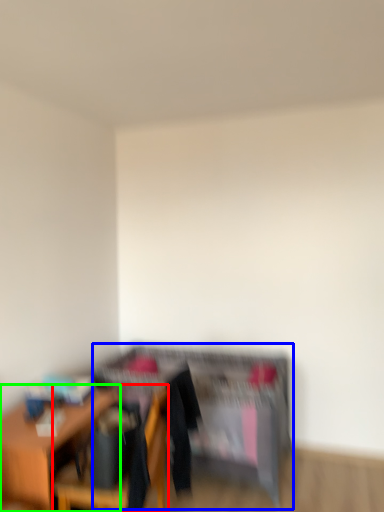
Question: Which object is positioned farthest from chair (highlighted by a red box)? Select from dresser (highlighted by a blue box) and table (highlighted by a green box).

Choices:
 (A) dresser
 (B) table

Answer: (A)